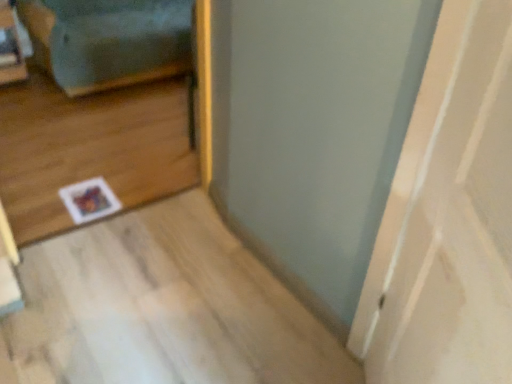
Question: Should I look upward or downward to see blue fabric couch at left?

Choices:
 (A) down
 (B) up

Answer: (B)

Question: From the image's perspective, would you say blue fabric couch at left is positioned over white matte door at center?

Choices:
 (A) no
 (B) yes

Answer: (B)

Question: Are blue fabric couch at left and white matte door at center beside each other?

Choices:
 (A) no
 (B) yes

Answer: (A)

Question: From the image's perspective, is blue fabric couch at left beneath white matte door at center?

Choices:
 (A) yes
 (B) no

Answer: (B)

Question: Is white matte door at center located within blue fabric couch at left?

Choices:
 (A) no
 (B) yes

Answer: (A)

Question: Is blue fabric couch at left oriented towards white matte door at center?

Choices:
 (A) yes
 (B) no

Answer: (A)

Question: Would you say blue fabric couch at left is outside white matte door at center?

Choices:
 (A) yes
 (B) no

Answer: (A)

Question: From a real-world perspective, is white matte door at center physically below blue fabric couch at left?

Choices:
 (A) yes
 (B) no

Answer: (B)

Question: Is white matte door at center oriented towards blue fabric couch at left?

Choices:
 (A) yes
 (B) no

Answer: (B)

Question: Can you confirm if white matte door at center is smaller than blue fabric couch at left?

Choices:
 (A) yes
 (B) no

Answer: (A)

Question: From a real-world perspective, is white matte door at center positioned over blue fabric couch at left based on gravity?

Choices:
 (A) no
 (B) yes

Answer: (B)

Question: Considering the relative sizes of white matte door at center and blue fabric couch at left in the image provided, is white matte door at center bigger than blue fabric couch at left?

Choices:
 (A) yes
 (B) no

Answer: (B)

Question: Can blue fabric couch at left be found inside white matte door at center?

Choices:
 (A) yes
 (B) no

Answer: (B)

Question: In terms of width, does blue fabric couch at left look wider or thinner when compared to white matte door at center?

Choices:
 (A) wide
 (B) thin

Answer: (A)